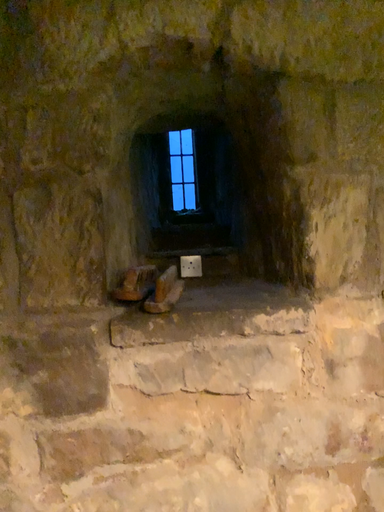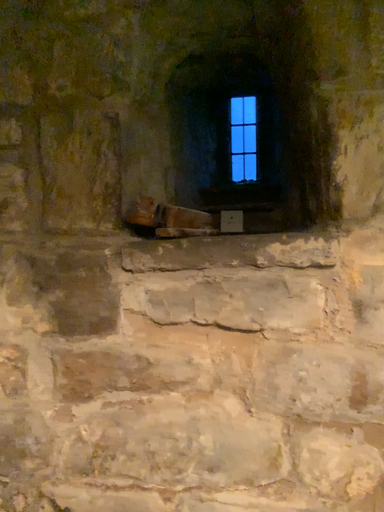
Question: How did the camera likely rotate when shooting the video?

Choices:
 (A) rotated right
 (B) rotated left

Answer: (B)